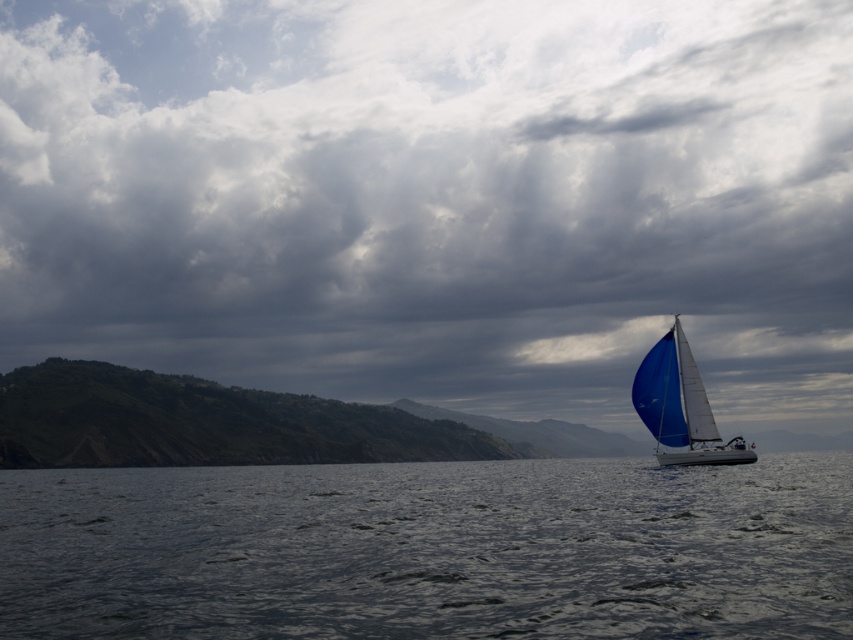
You are a sailor on a ship and you look up at the cloudy sky at upper center and see the blue sailboat at right in the distance. Which object is higher in the sky?

The cloudy sky at upper center is located above the blue sailboat at right, so the cloudy sky at upper center is higher in the sky.

You are a sailor navigating a boat and you see the cloudy sky at upper center and the blue sailboat at right. Which object is positioned to the left of the other?

The cloudy sky at upper center is to the left of the blue sailboat at right.